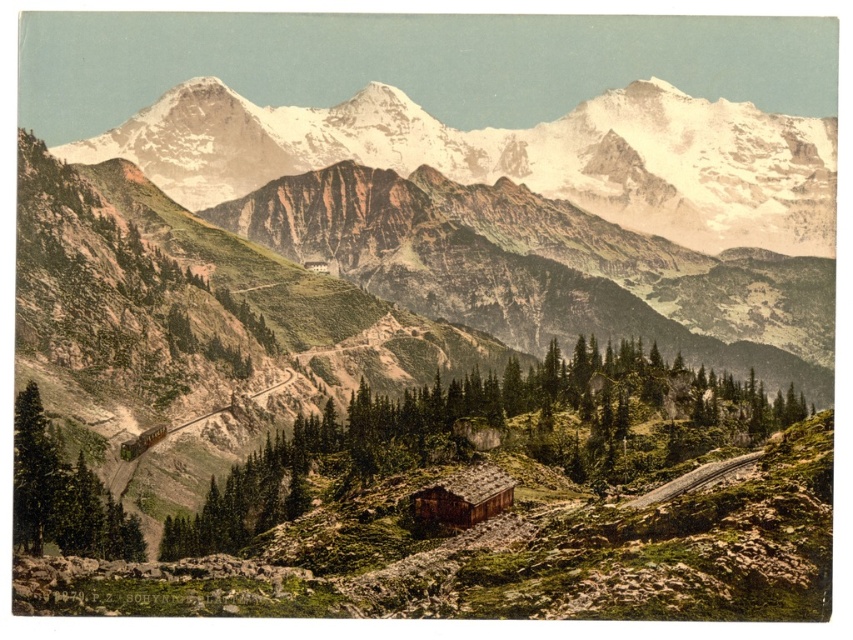
You are a hiker standing at the base of the snowy granite mountains at upper center. You want to reach the summit. Given that the average hiker ascends 1000 feet per hour, how long would it take to reach the summit?

The snowy granite mountains at upper center is 1431.10 feet from viewer. At an average ascent rate of 1000 feet per hour, it would take approximately 1.43 hours, or roughly 1 hour and 26 minutes, to reach the summit.

You are a traveler who wants to stay overnight in a cabin. You see both the green textured log cabin at center and the brown wooden cabin at center. Which one is bigger?

The green textured log cabin at center is larger in size compared to the brown wooden cabin at center.

You are a photographer planning to capture the snowy granite mountains at upper center and the green textured tree at lower left in a single frame. Given that your camera has a fixed focal length, which object should you prioritize positioning closer to the center of the frame to ensure both are visible without cropping?

Since the snowy granite mountains at upper center are wider than the green textured tree at lower left, positioning the snowy granite mountains at upper center closer to the center of the frame would help maintain both objects within the frame without cropping.